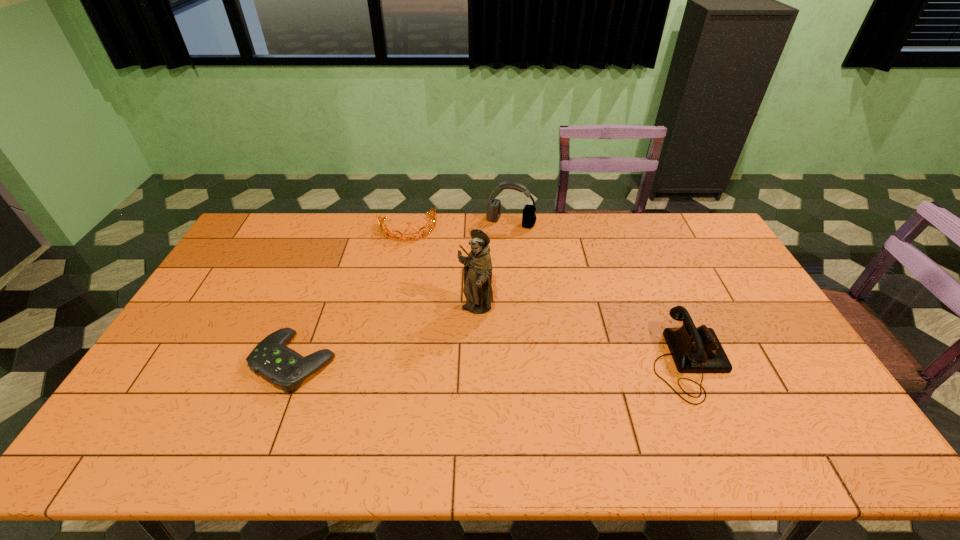
Find the location of a particular element. headset that is at the far edge is located at coordinates (494, 205).

This screenshot has height=540, width=960. Identify the location of tiara situated at the far edge. (432, 227).

Identify the location of control positioned at the near edge. (280, 365).

Locate an element on the screen. This screenshot has height=540, width=960. telephone that is at the near edge is located at coordinates (694, 350).

Locate an element on the screen. The width and height of the screenshot is (960, 540). vacant area at the far edge of the desktop is located at coordinates (426, 237).

Image resolution: width=960 pixels, height=540 pixels. In the image, there is a desktop. In order to click on free space at the near edge in this screenshot , I will do `click(230, 397)`.

In order to click on vacant region at the left edge of the desktop in this screenshot , I will do `click(276, 253)`.

This screenshot has height=540, width=960. What are the coordinates of `blank space at the right edge of the desktop` in the screenshot? It's located at (783, 333).

At what (x,y) coordinates should I click in order to perform the action: click on blank area at the far right corner. Please return your answer as a coordinate pair (x, y). Image resolution: width=960 pixels, height=540 pixels. Looking at the image, I should click on (704, 219).

Locate an element on the screen. This screenshot has width=960, height=540. unoccupied position between the rightmost object and the figurine is located at coordinates (x=582, y=335).